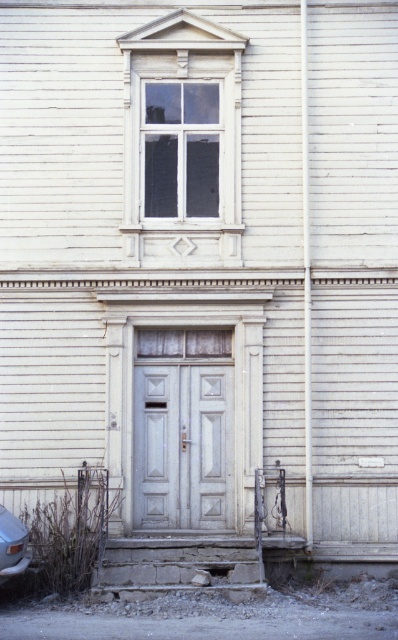
You are standing in front of the building and notice a point marked at coordinates [181,148]. Based on the scene description, what object is located at that point?

The point at coordinates [181,148] marks the white glass window at upper center.

You are a painter standing in front of the building and need to decide which object to paint first between the white wood window at upper center and the white matte door at center. Which one requires a longer ladder to reach?

The white wood window at upper center requires a longer ladder because it is much taller than the white matte door at center.